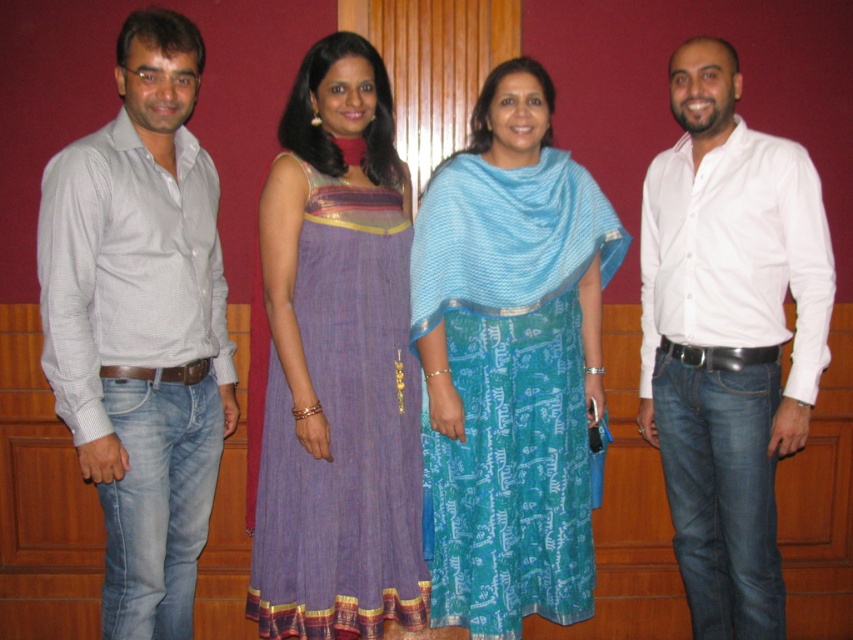
You are standing in the room and want to locate the blue printed dress at center. According to the coordinates provided, where exactly is it positioned in the image?

The blue printed dress at center is located at point coordinates of (509,364).

You are standing in the room and want to know the exact location of the white cotton shirt at right. Can you tell me its coordinates?

The white cotton shirt at right is located at coordinates point (728, 337).